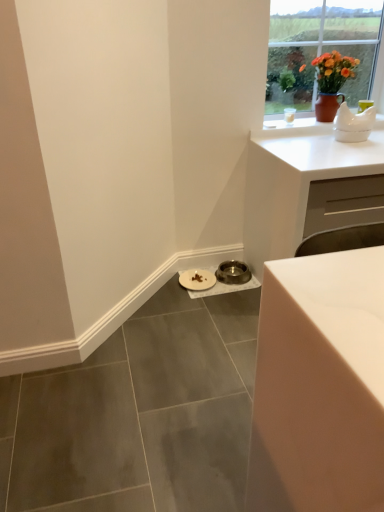
What do you see at coordinates (233, 272) in the screenshot?
I see `metallic silver bowl at lower center, the second manhole cover in the left-to-right sequence` at bounding box center [233, 272].

The height and width of the screenshot is (512, 384). Describe the element at coordinates (197, 280) in the screenshot. I see `white matte plate at lower center, which is counted as the 1th manhole cover, starting from the left` at that location.

Identify the location of matte brown vase at upper right. Image resolution: width=384 pixels, height=512 pixels. (320, 47).

The image size is (384, 512). Describe the element at coordinates (320, 47) in the screenshot. I see `matte brown vase at upper right` at that location.

This screenshot has height=512, width=384. Describe the element at coordinates (294, 127) in the screenshot. I see `white ceramic teapot at upper right` at that location.

At what (x,y) coordinates should I click in order to perform the action: click on white glossy table at lower right. Please return your answer as a coordinate pair (x, y). The image size is (384, 512). Looking at the image, I should click on (319, 385).

Identify the location of the 2nd manhole cover to the left when counting from the white ceramic teapot at upper right. (197, 280).

Is white ceramic teapot at upper right beside white matte plate at lower center, which is counted as the 1th manhole cover, starting from the left?

No, white ceramic teapot at upper right is not with white matte plate at lower center, which is counted as the 1th manhole cover, starting from the left.

Is white ceramic teapot at upper right positioned beyond the bounds of white matte plate at lower center, which is the 2th manhole cover in right-to-left order?

white ceramic teapot at upper right is positioned outside white matte plate at lower center, which is the 2th manhole cover in right-to-left order.

From the image's perspective, which is below, white ceramic teapot at upper right or white matte plate at lower center, which is counted as the 1th manhole cover, starting from the left?

From the image's view, white matte plate at lower center, which is counted as the 1th manhole cover, starting from the left, is below.

Considering the positions of points (209, 282) and (319, 143), is point (209, 282) farther from camera compared to point (319, 143)?

Yes, point (209, 282) is behind point (319, 143).

Looking at this image, between white matte plate at lower center, which is counted as the 1th manhole cover, starting from the left, and white matte cabinet at upper right, which one appears on the left side from the viewer's perspective?

Positioned to the left is white matte plate at lower center, which is counted as the 1th manhole cover, starting from the left.

The height and width of the screenshot is (512, 384). In order to click on cabinetry that is in front of the white matte plate at lower center, which is the 2th manhole cover in right-to-left order in this screenshot , I will do `click(296, 181)`.

Who is taller, white matte plate at lower center, which is the 2th manhole cover in right-to-left order, or white matte cabinet at upper right?

white matte cabinet at upper right.

Considering the relative sizes of matte brown vase at upper right and metallic silver bowl at lower center, which is counted as the first manhole cover, starting from the right, in the image provided, is matte brown vase at upper right taller than metallic silver bowl at lower center, which is counted as the first manhole cover, starting from the right,?

Correct, matte brown vase at upper right is much taller as metallic silver bowl at lower center, which is counted as the first manhole cover, starting from the right.

Considering the sizes of objects matte brown vase at upper right and metallic silver bowl at lower center, the second manhole cover in the left-to-right sequence, in the image provided, who is bigger, matte brown vase at upper right or metallic silver bowl at lower center, the second manhole cover in the left-to-right sequence,?

Bigger between the two is matte brown vase at upper right.

From the image's perspective, is matte brown vase at upper right positioned above or below metallic silver bowl at lower center, which is counted as the first manhole cover, starting from the right?

matte brown vase at upper right is above metallic silver bowl at lower center, which is counted as the first manhole cover, starting from the right.

Would you say matte brown vase at upper right is inside or outside metallic silver bowl at lower center, the second manhole cover in the left-to-right sequence?

matte brown vase at upper right is not inside metallic silver bowl at lower center, the second manhole cover in the left-to-right sequence, it's outside.

Are white matte cabinet at upper right and white ceramic teapot at upper right located far from each other?

No.

Considering the relative sizes of white matte cabinet at upper right and white ceramic teapot at upper right in the image provided, is white matte cabinet at upper right thinner than white ceramic teapot at upper right?

Incorrect, the width of white matte cabinet at upper right is not less than that of white ceramic teapot at upper right.

Measure the distance from white matte cabinet at upper right to white ceramic teapot at upper right.

A distance of 12.83 inches exists between white matte cabinet at upper right and white ceramic teapot at upper right.

Image resolution: width=384 pixels, height=512 pixels. I want to click on cabinetry on the right side of white ceramic teapot at upper right, so click(296, 181).

Does point (268, 127) come closer to viewer compared to point (378, 6)?

That is True.

Is white ceramic teapot at upper right at the right side of matte brown vase at upper right?

Incorrect, white ceramic teapot at upper right is not on the right side of matte brown vase at upper right.

Is white ceramic teapot at upper right facing away from matte brown vase at upper right?

No, white ceramic teapot at upper right is not facing the opposite direction of matte brown vase at upper right.

Does white ceramic teapot at upper right have a lesser height compared to matte brown vase at upper right?

Yes.

From a real-world perspective, between matte brown vase at upper right and white matte plate at lower center, which is counted as the 1th manhole cover, starting from the left, who is vertically lower?

white matte plate at lower center, which is counted as the 1th manhole cover, starting from the left, is physically lower.

Is point (345, 25) in front of point (204, 271)?

Yes, point (345, 25) is in front of point (204, 271).

Does matte brown vase at upper right have a lesser width compared to white matte plate at lower center, which is counted as the 1th manhole cover, starting from the left?

No, matte brown vase at upper right is not thinner than white matte plate at lower center, which is counted as the 1th manhole cover, starting from the left.

In the scene shown: Which object is positioned more to the right, matte brown vase at upper right or white matte plate at lower center, which is the 2th manhole cover in right-to-left order?

matte brown vase at upper right.

Is white matte plate at lower center, which is the 2th manhole cover in right-to-left order, facing away from white glossy table at lower right?

No, white matte plate at lower center, which is the 2th manhole cover in right-to-left order, is not facing away from white glossy table at lower right.

In the scene shown: Which object is wider, white matte plate at lower center, which is the 2th manhole cover in right-to-left order, or white glossy table at lower right?

white glossy table at lower right is wider.

From the picture: Is white matte plate at lower center, which is counted as the 1th manhole cover, starting from the left, positioned beyond the bounds of white glossy table at lower right?

That's correct, white matte plate at lower center, which is counted as the 1th manhole cover, starting from the left, is outside of white glossy table at lower right.

How many degrees apart are the facing directions of white matte plate at lower center, which is counted as the 1th manhole cover, starting from the left, and white glossy table at lower right?

The angle between the facing direction of white matte plate at lower center, which is counted as the 1th manhole cover, starting from the left, and the facing direction of white glossy table at lower right is 1.6 degrees.

Where is `window sill above the white matte plate at lower center, which is counted as the 1th manhole cover, starting from the left (from the image's perspective)`? window sill above the white matte plate at lower center, which is counted as the 1th manhole cover, starting from the left (from the image's perspective) is located at coordinates (294, 127).

The image size is (384, 512). Identify the location of cabinetry on the right of white matte plate at lower center, which is the 2th manhole cover in right-to-left order. tap(296, 181).

Looking at the image, which one is located closer to matte brown vase at upper right, white matte cabinet at upper right or white ceramic teapot at upper right?

white ceramic teapot at upper right.

When comparing their distances from white matte cabinet at upper right, does white matte plate at lower center, which is the 2th manhole cover in right-to-left order, or matte brown vase at upper right seem further?

Among the two, white matte plate at lower center, which is the 2th manhole cover in right-to-left order, is located further to white matte cabinet at upper right.

When comparing their distances from metallic silver bowl at lower center, which is counted as the first manhole cover, starting from the right, does white matte cabinet at upper right or white ceramic teapot at upper right seem further?

white ceramic teapot at upper right is positioned further to the anchor metallic silver bowl at lower center, which is counted as the first manhole cover, starting from the right.

When comparing their distances from matte brown vase at upper right, does white ceramic teapot at upper right or metallic silver bowl at lower center, the second manhole cover in the left-to-right sequence, seem further?

Among the two, metallic silver bowl at lower center, the second manhole cover in the left-to-right sequence, is located further to matte brown vase at upper right.

Considering their positions, is white glossy table at lower right positioned closer to matte brown vase at upper right than metallic silver bowl at lower center, which is counted as the first manhole cover, starting from the right?

Based on the image, metallic silver bowl at lower center, which is counted as the first manhole cover, starting from the right, appears to be nearer to matte brown vase at upper right.

Which object lies nearer to the anchor point white matte plate at lower center, which is counted as the 1th manhole cover, starting from the left, white ceramic teapot at upper right or white glossy table at lower right?

white ceramic teapot at upper right lies closer to white matte plate at lower center, which is counted as the 1th manhole cover, starting from the left, than the other object.

From the image, which object appears to be nearer to white glossy table at lower right, white ceramic teapot at upper right or white matte cabinet at upper right?

white matte cabinet at upper right lies closer to white glossy table at lower right than the other object.

Estimate the real-world distances between objects in this image. Which object is closer to white matte plate at lower center, which is the 2th manhole cover in right-to-left order, matte brown vase at upper right or white glossy table at lower right?

matte brown vase at upper right is positioned closer to the anchor white matte plate at lower center, which is the 2th manhole cover in right-to-left order.

The height and width of the screenshot is (512, 384). Identify the location of cabinetry that lies between white ceramic teapot at upper right and white matte plate at lower center, which is the 2th manhole cover in right-to-left order, from top to bottom. (296, 181).

The width and height of the screenshot is (384, 512). I want to click on cabinetry between white glossy table at lower right and matte brown vase at upper right along the z-axis, so click(x=296, y=181).

Where is `window sill that lies between matte brown vase at upper right and white matte plate at lower center, which is counted as the 1th manhole cover, starting from the left, from top to bottom`? The width and height of the screenshot is (384, 512). window sill that lies between matte brown vase at upper right and white matte plate at lower center, which is counted as the 1th manhole cover, starting from the left, from top to bottom is located at coordinates (294, 127).

Where is `window sill between white glossy table at lower right and white matte plate at lower center, which is counted as the 1th manhole cover, starting from the left, from front to back`? The width and height of the screenshot is (384, 512). window sill between white glossy table at lower right and white matte plate at lower center, which is counted as the 1th manhole cover, starting from the left, from front to back is located at coordinates (294, 127).